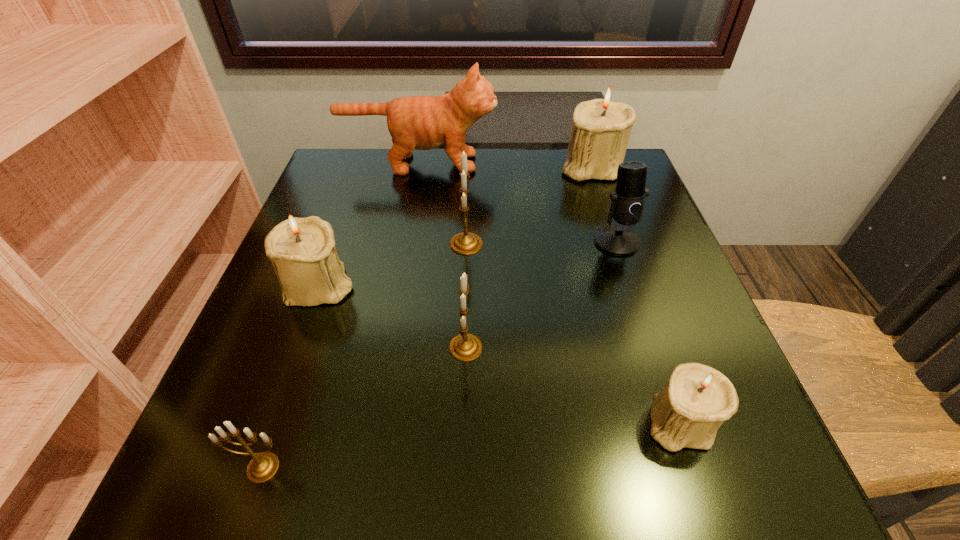
Image resolution: width=960 pixels, height=540 pixels. I want to click on the leftmost gold candelabrum, so click(x=262, y=467).

The height and width of the screenshot is (540, 960). I want to click on the smallest gold candelabrum, so [262, 467].

Find the location of a particular element. Image resolution: width=960 pixels, height=540 pixels. vacant space located 0.160m on the face of the ginger cat is located at coordinates (x=559, y=163).

Locate an element on the screen. vacant region located 0.050m on the left of the biggest beige candle_holder is located at coordinates (540, 166).

This screenshot has width=960, height=540. I want to click on vacant space located 0.210m on the back of the farthest gold candelabrum, so click(x=468, y=172).

Locate an element on the screen. blank space located 0.270m on the stand of the black microphone is located at coordinates (661, 374).

Where is `blank area located 0.380m on the back of the second farthest beige candle_holder`? This screenshot has width=960, height=540. blank area located 0.380m on the back of the second farthest beige candle_holder is located at coordinates (363, 161).

This screenshot has width=960, height=540. I want to click on free location located on the back of the sixth farthest object, so click(x=469, y=198).

You are a GUI agent. You are given a task and a screenshot of the screen. Output one action in this format:
    pyautogui.click(x=<x>, y=<y>)
    Task: Click on the vacant space located on the back of the smallest beige candle_holder
    This screenshot has width=960, height=540.
    Given the screenshot: What is the action you would take?
    pyautogui.click(x=639, y=302)

This screenshot has height=540, width=960. Find the location of `free region located on the back of the nearest gold candelabrum`. free region located on the back of the nearest gold candelabrum is located at coordinates (282, 411).